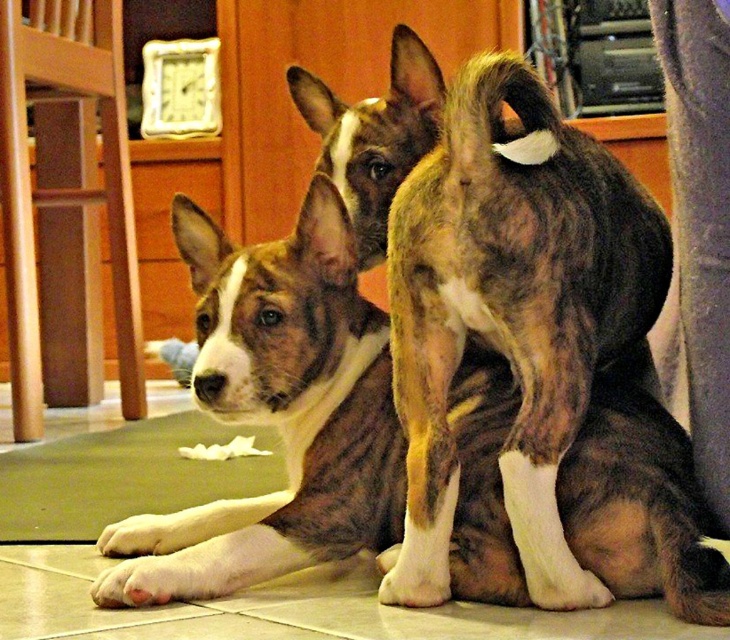
You are a photographer trying to capture a clear photo of both dogs. Since the dogs are positioned close to each other, will the brown brindle fur at center be blocking the view of the brown brindle coat at center?

The brown brindle fur at center is in front of the brown brindle coat at center, so it will block the view of the brown brindle coat at center.

You are a pet sitter who needs to place a 30 inch long toy between the brown brindle coat at center and the green fabric mat at lower left. Will the toy fit in the space between them?

The distance between the brown brindle coat at center and the green fabric mat at lower left is 32.50 inches. Since the toy is 30 inches long, it will fit with 2.5 inches of space remaining.